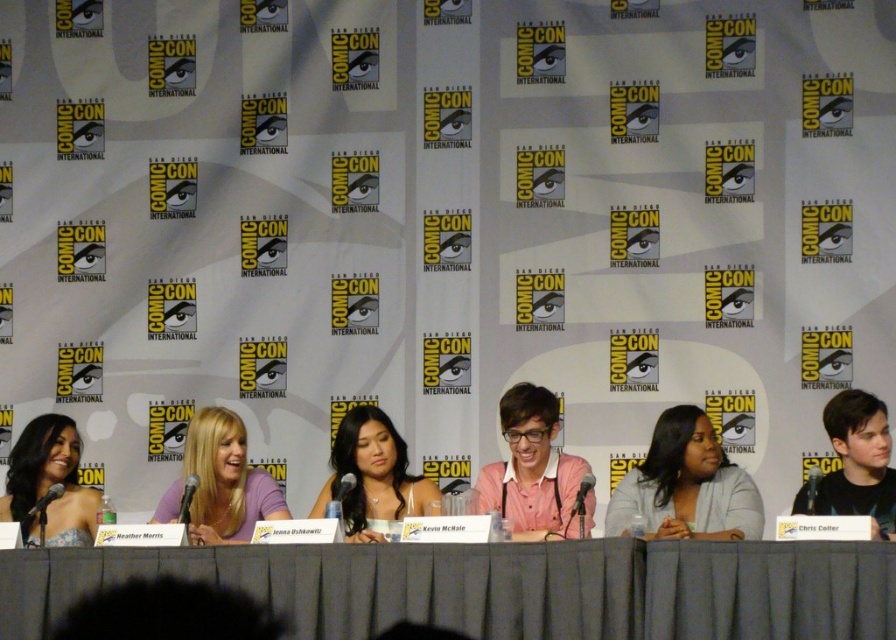
Who is taller, gray fabric table at center or smooth gray blazer at center?

With more height is smooth gray blazer at center.

Identify the location of gray fabric table at center. The width and height of the screenshot is (896, 640). (502, 588).

Where is `gray fabric table at center`? Image resolution: width=896 pixels, height=640 pixels. gray fabric table at center is located at coordinates (502, 588).

Can you confirm if matte purple shirt at center is positioned to the right of smooth black shirt at right?

Incorrect, matte purple shirt at center is not on the right side of smooth black shirt at right.

Who is higher up, matte purple shirt at center or smooth black shirt at right?

Positioned higher is smooth black shirt at right.

Which is in front, point (185, 458) or point (810, 502)?

Positioned in front is point (810, 502).

The image size is (896, 640). I want to click on matte purple shirt at center, so click(221, 483).

Can you confirm if gray fabric table at center is bigger than matte black dress at left?

Yes.

Who is shorter, gray fabric table at center or matte black dress at left?

With less height is gray fabric table at center.

The image size is (896, 640). Describe the element at coordinates (502, 588) in the screenshot. I see `gray fabric table at center` at that location.

At what (x,y) coordinates should I click in order to perform the action: click on gray fabric table at center. Please return your answer as a coordinate pair (x, y). This screenshot has width=896, height=640. Looking at the image, I should click on (502, 588).